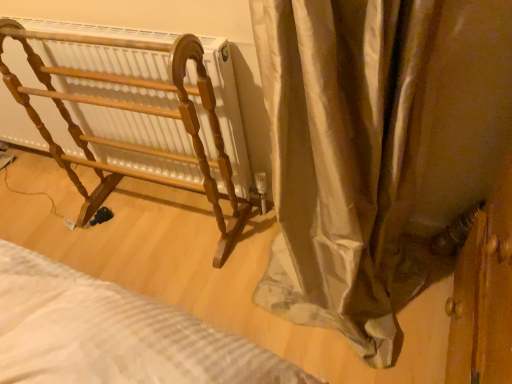
Question: Based on their sizes in the image, would you say wooden rack at left is bigger or smaller than silky beige curtain at center?

Choices:
 (A) big
 (B) small

Answer: (B)

Question: From the image's perspective, relative to silky beige curtain at center, is wooden rack at left above or below?

Choices:
 (A) below
 (B) above

Answer: (B)

Question: Is wooden rack at left in front of or behind silky beige curtain at center in the image?

Choices:
 (A) front
 (B) behind

Answer: (B)

Question: Is silky beige curtain at center wider or thinner than wooden rack at left?

Choices:
 (A) wide
 (B) thin

Answer: (A)

Question: Is point (346, 87) closer or farther from the camera than point (91, 195)?

Choices:
 (A) closer
 (B) farther

Answer: (A)

Question: Which is correct: silky beige curtain at center is inside wooden rack at left, or outside of it?

Choices:
 (A) inside
 (B) outside

Answer: (B)

Question: In the image, is silky beige curtain at center positioned in front of or behind wooden rack at left?

Choices:
 (A) front
 (B) behind

Answer: (A)